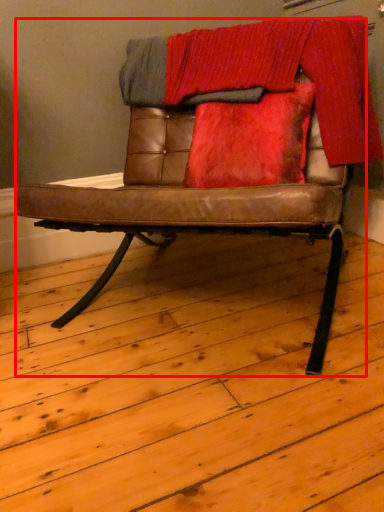
Question: Where is chair (annotated by the red box) located in relation to blanket in the image?

Choices:
 (A) right
 (B) left

Answer: (B)